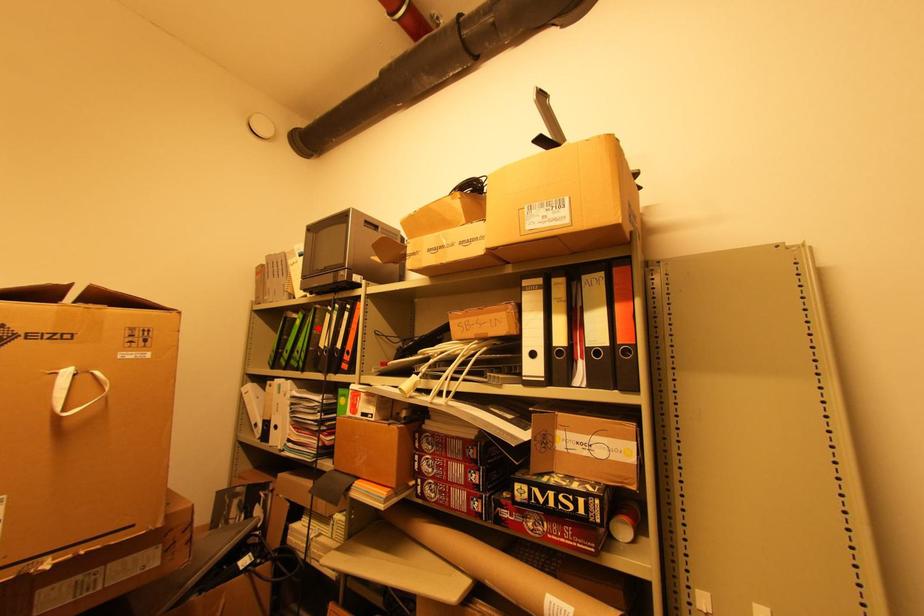
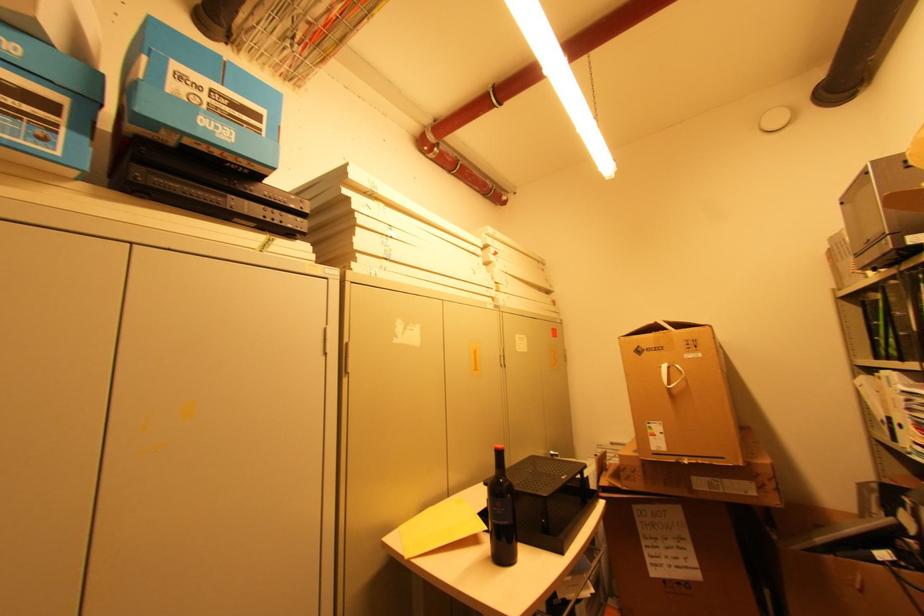
The point at the highlighted location is marked in the first image. Where is the corresponding point in the second image?

(896, 310)